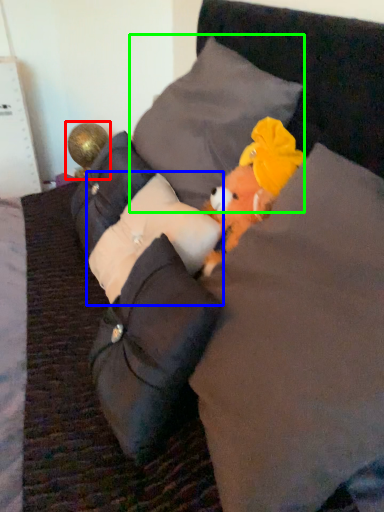
Question: Which is farther away from toy (highlighted by a red box)? pillow (highlighted by a blue box) or pillow (highlighted by a green box)?

Choices:
 (A) pillow
 (B) pillow

Answer: (A)